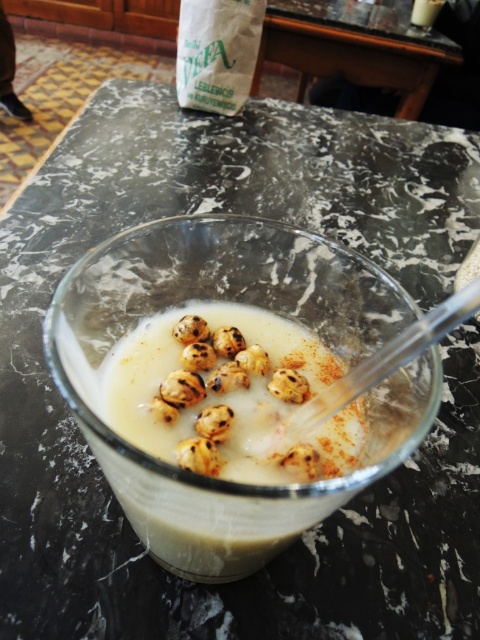
Question: Is marble table at center positioned behind brown textured nut at center?

Choices:
 (A) yes
 (B) no

Answer: (A)

Question: Which point is closer to the camera taking this photo?

Choices:
 (A) (372, 68)
 (B) (277, 374)

Answer: (B)

Question: Based on their relative distances, which object is farther from the brown charred balls at center?

Choices:
 (A) marble table at center
 (B) brown textured nut at center

Answer: (A)

Question: Which point is closer to the camera taking this photo?

Choices:
 (A) (289, 380)
 (B) (415, 36)
 (C) (222, 372)

Answer: (A)

Question: Is brown charred balls at center wider than brown textured nut at center?

Choices:
 (A) no
 (B) yes

Answer: (B)

Question: Is brown charred balls at center below brown textured nut at center?

Choices:
 (A) no
 (B) yes

Answer: (B)